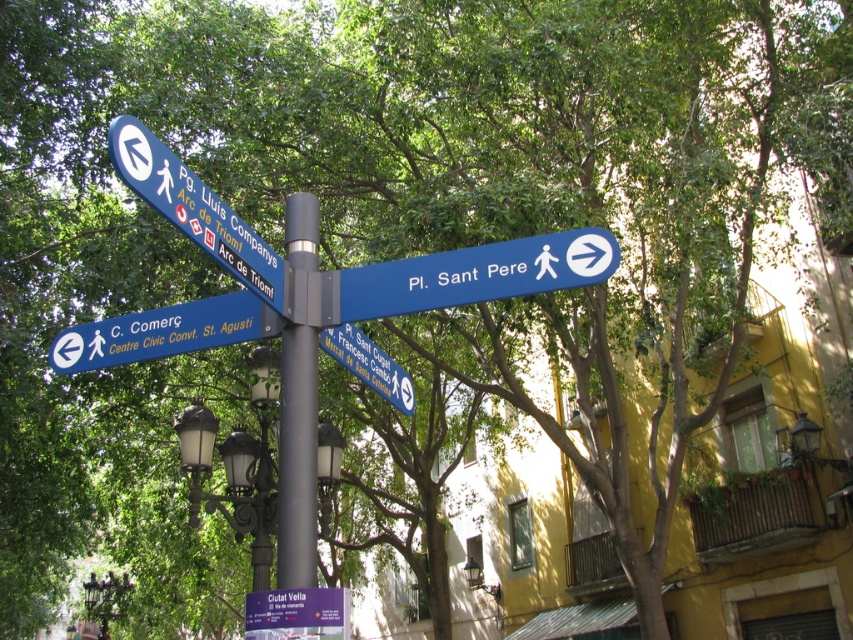
You are a tourist in Barcelona holding a map and looking at the multi directional signpost. You need to find the purple plastic sign at center and the blue plastic sign at upper right. Which one is located to the right of the other?

The blue plastic sign at upper right is positioned on the right side of purple plastic sign at center.

What are the coordinates of the black metal pole at center?

The coordinates of the black metal pole at center are point (297, 458).

You are a delivery driver who needs to attach a GPS tracker to the black metal pole at center and the blue plastic sign at left. The GPS tracker requires a minimum of 18 inches of space to function properly. Can you place the tracker on both objects without overlapping?

The black metal pole at center is 18.10 inches from the blue plastic sign at left. Since the distance is slightly over the required 18 inches, the GPS tracker can be placed on both objects without overlapping.